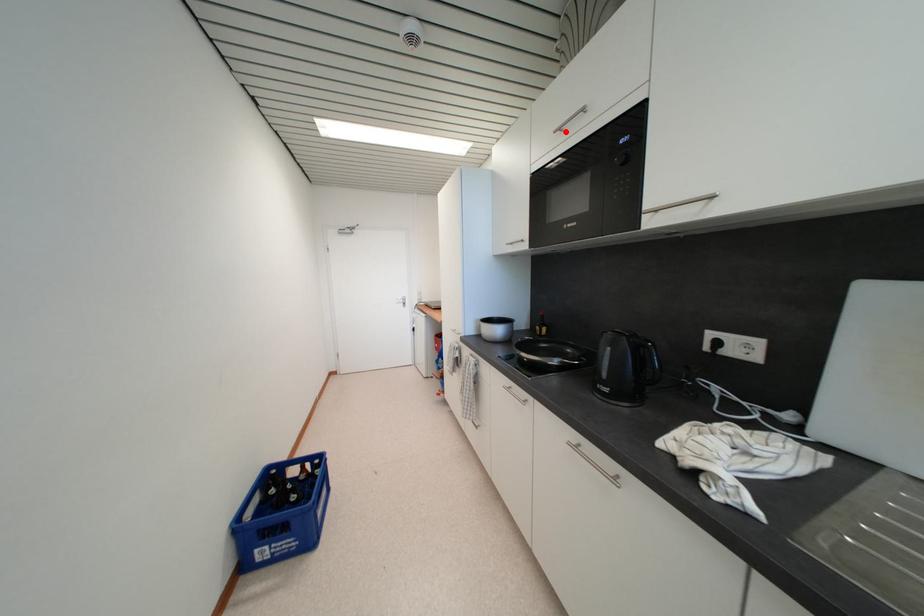
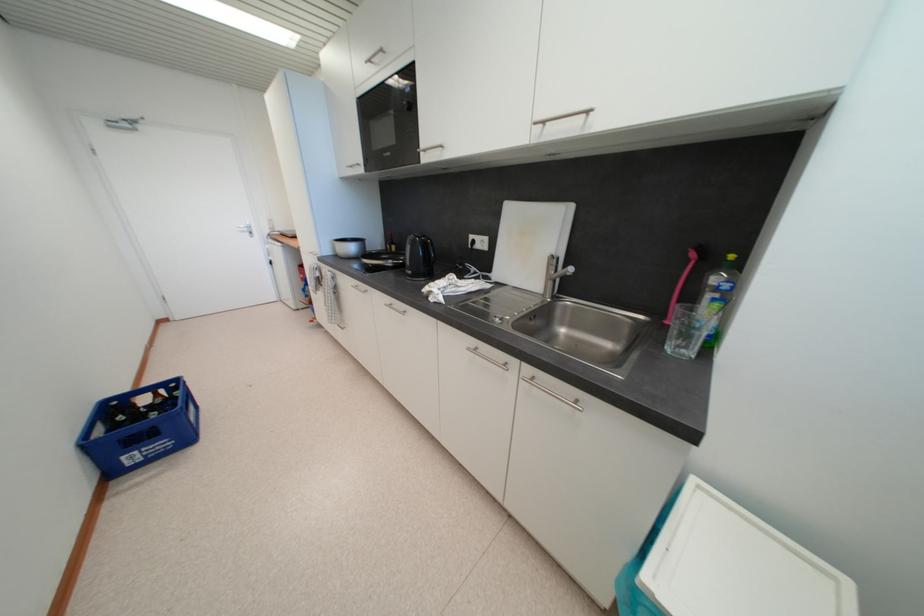
Locate, in the second image, the point that corresponds to the highlighted location in the first image.

(375, 63)